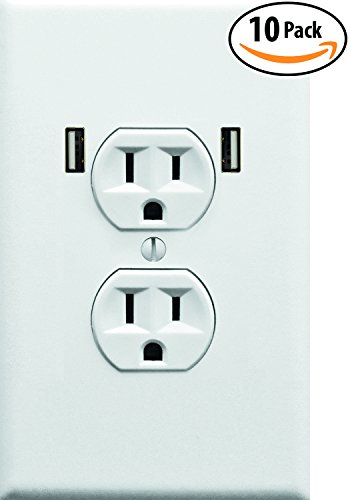
Image resolution: width=350 pixels, height=500 pixels. In order to click on plate in this screenshot , I will do `click(231, 261)`.